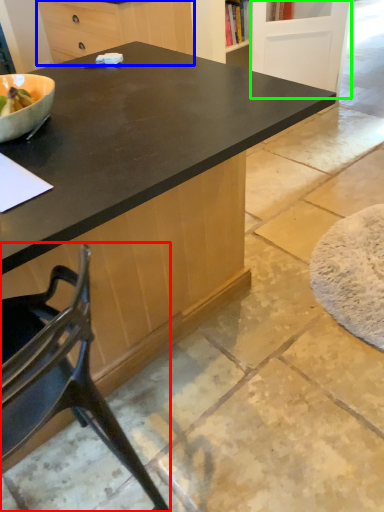
Question: Estimate the real-world distances between objects in this image. Which object is farther from chair (highlighted by a red box), cabinetry (highlighted by a blue box) or screen door (highlighted by a green box)?

Choices:
 (A) cabinetry
 (B) screen door

Answer: (B)